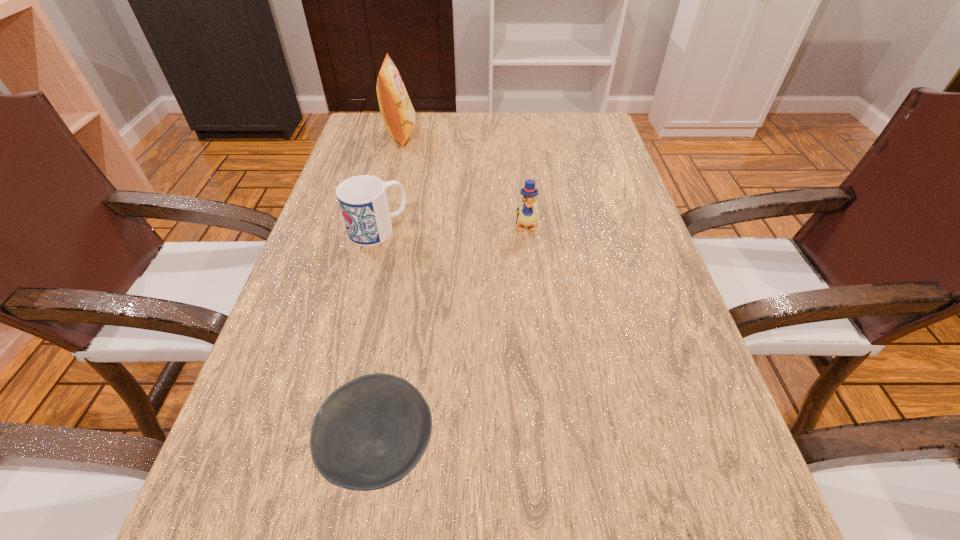
At what (x,y) coordinates should I click in order to perform the action: click on the farthest object. Please return your answer as a coordinate pair (x, y). This screenshot has width=960, height=540. Looking at the image, I should click on (398, 114).

Locate an element on the screen. Image resolution: width=960 pixels, height=540 pixels. crisp (potato chip) is located at coordinates (398, 114).

You are a GUI agent. You are given a task and a screenshot of the screen. Output one action in this format:
    pyautogui.click(x=<x>, y=<y>)
    Task: Click on the rightmost object
    
    Given the screenshot: What is the action you would take?
    pyautogui.click(x=527, y=217)

Where is `mug`? The height and width of the screenshot is (540, 960). mug is located at coordinates (363, 202).

Locate an element on the screen. bowl is located at coordinates (371, 432).

I want to click on the shortest object, so click(371, 432).

This screenshot has width=960, height=540. Find the location of `free space located 0.290m on the front-facing side of the crisp (potato chip)`. free space located 0.290m on the front-facing side of the crisp (potato chip) is located at coordinates (516, 134).

At what (x,y) coordinates should I click in order to perform the action: click on vacant space located 0.310m on the face of the rightmost object, where the monocle is placed. Please return your answer as a coordinate pair (x, y). This screenshot has width=960, height=540. Looking at the image, I should click on (539, 351).

Image resolution: width=960 pixels, height=540 pixels. In order to click on free spot located 0.330m on the back of the mug in this screenshot , I will do `click(399, 141)`.

Identify the location of vacant space located 0.050m on the back of the bowl. This screenshot has height=540, width=960. (393, 369).